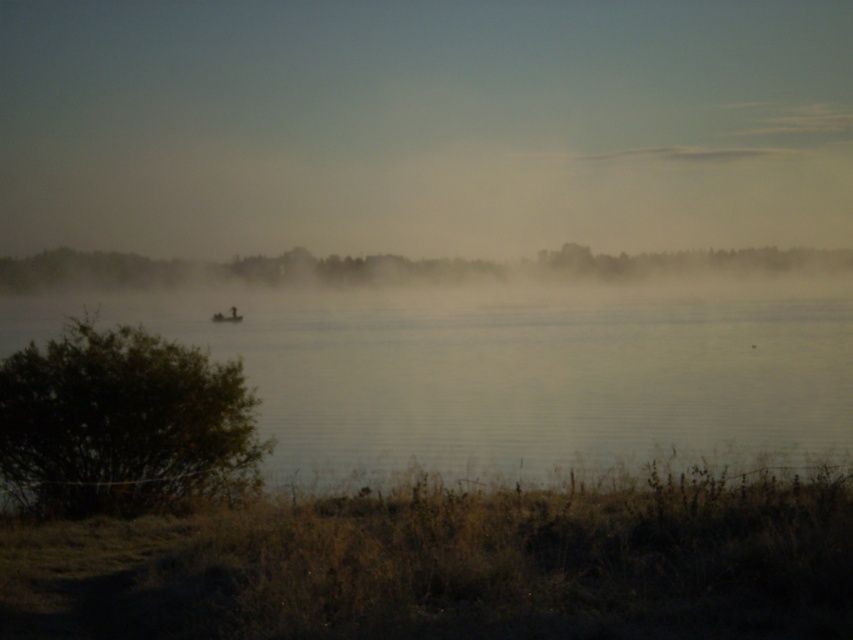
Question: Which object appears farthest from the camera in this image?

Choices:
 (A) green leafy tree at center
 (B) clear water at center

Answer: (A)

Question: From the image, what is the correct spatial relationship of clear water at center in relation to green leafy bush at lower left?

Choices:
 (A) below
 (B) above

Answer: (B)

Question: Which point is farther to the camera?

Choices:
 (A) (593, 339)
 (B) (119, 268)
 (C) (109, 500)

Answer: (B)

Question: Which of these objects is positioned farthest from the green leafy bush at lower left?

Choices:
 (A) green leafy tree at center
 (B) clear water at center

Answer: (A)

Question: From the image, what is the correct spatial relationship of clear water at center in relation to green leafy tree at center?

Choices:
 (A) above
 (B) below

Answer: (B)

Question: Observing the image, what is the correct spatial positioning of green leafy bush at lower left in reference to green leafy tree at center?

Choices:
 (A) right
 (B) left

Answer: (B)